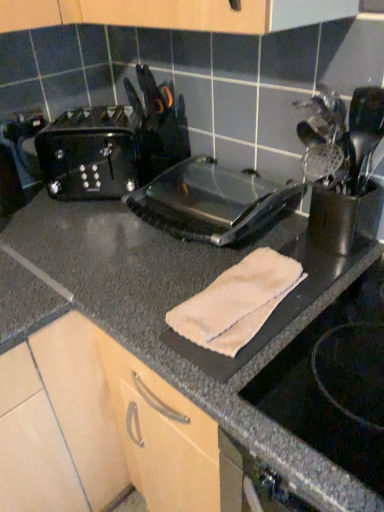
At what (x,y) coordinates should I click in order to perform the action: click on unoccupied area behind beige cotton towel at center. Please return your answer as a coordinate pair (x, y). Looking at the image, I should click on (205, 254).